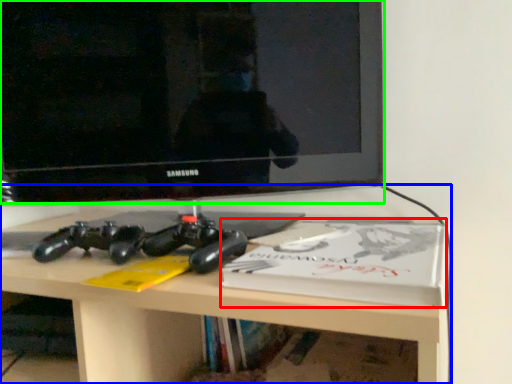
Question: Which is nearer to the paperback book (highlighted by a red box)? desk (highlighted by a blue box) or television (highlighted by a green box).

Choices:
 (A) desk
 (B) television

Answer: (A)